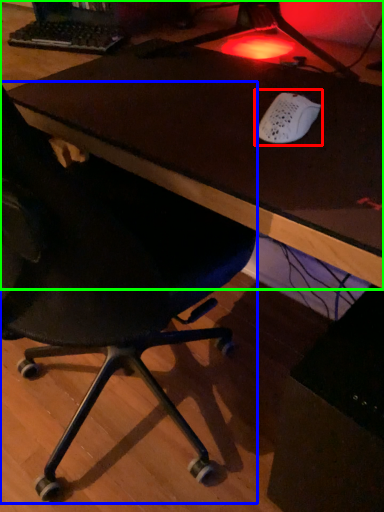
Question: Considering the real-world distances, which object is farthest from mouse (highlighted by a red box)? chair (highlighted by a blue box) or table (highlighted by a green box)?

Choices:
 (A) chair
 (B) table

Answer: (A)